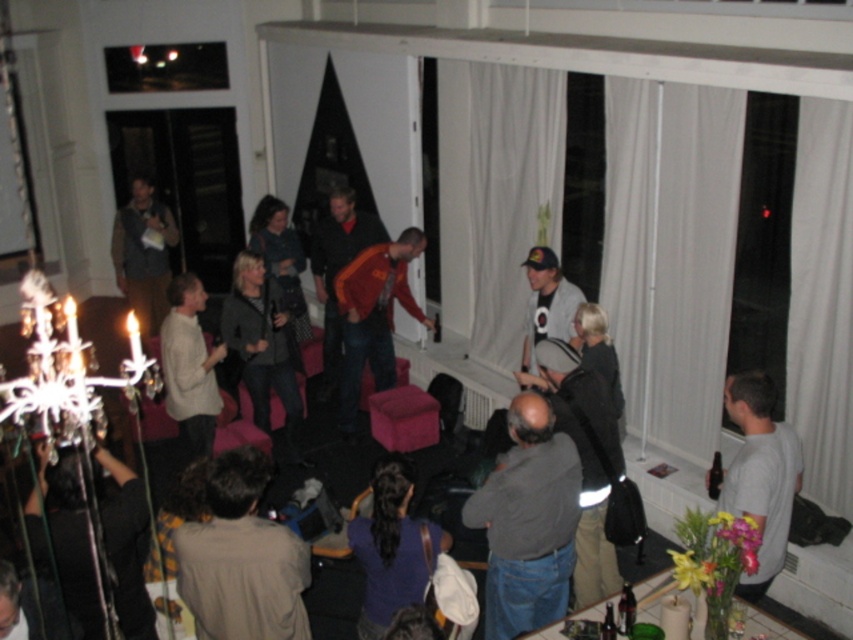
You are organizing a coat rack for guests at the party. Both the orange fleece jacket at center and the orange fabric jacket at center need to be hung. Since the coat rack has limited vertical space, which jacket should you choose to hang first to maximize the number of coats that can fit?

The orange fleece jacket at center has a lesser height compared to the orange fabric jacket at center. Therefore, you should hang the orange fleece jacket at center first to allow more space for taller jackets below.

You are standing in the room and want to move from the point at coordinates (555, 515) to the point at (740, 464). Which direction should you move to get closer to your destination?

You should move towards the direction away from the camera because the point at (740, 464) is closer to the camera than the point at (555, 515).